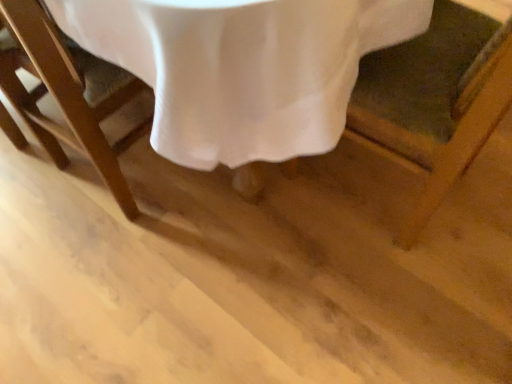
Identify the location of wooden chair at lower right. Image resolution: width=512 pixels, height=384 pixels. (431, 103).

The height and width of the screenshot is (384, 512). What do you see at coordinates (431, 103) in the screenshot? I see `wooden chair at lower right` at bounding box center [431, 103].

I want to click on wooden chair at lower right, so click(x=431, y=103).